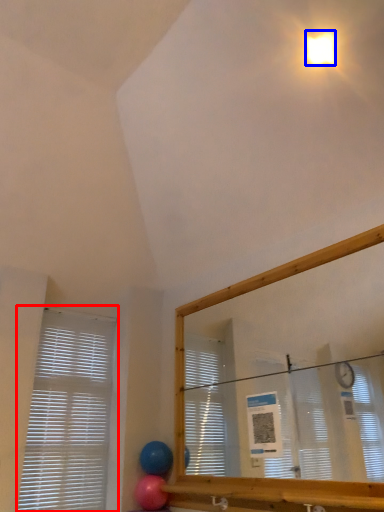
Question: Which object appears farthest to the camera in this image, window blind (highlighted by a red box) or light (highlighted by a blue box)?

Choices:
 (A) window blind
 (B) light

Answer: (A)